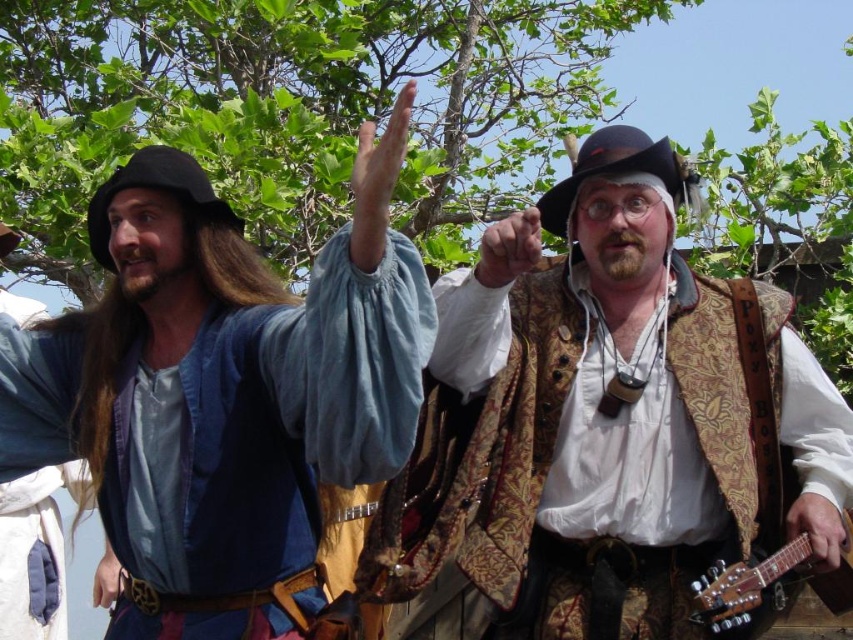
In the scene depicting two historical figures from a pirate event, there are two hands visible. One is a smooth skin hand at upper center and the other is a smooth leather glove at center. Which hand is positioned higher?

The smooth skin hand at upper center is positioned higher than the smooth leather glove at center.

You are a photographer at the pirate event and need to capture a closeup of both the smooth skin hand at upper center and the smooth leather glove at center. Which object is positioned closer to the camera?

The smooth skin hand at upper center is closer to the viewer than the smooth leather glove at center, so the smooth skin hand at upper center would be in focus first if the camera is focused on it.